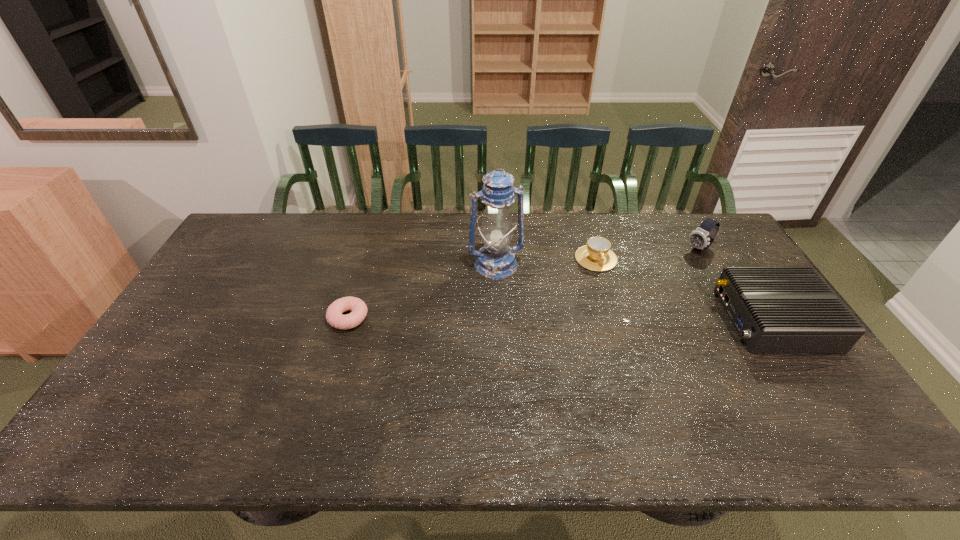
Image resolution: width=960 pixels, height=540 pixels. I want to click on blank space at the far left corner of the desktop, so click(x=255, y=251).

Find the location of a particular element. This screenshot has width=960, height=540. vacant region at the far right corner is located at coordinates (683, 224).

This screenshot has height=540, width=960. Find the location of `empty space that is in between the lantern and the shortest object`. empty space that is in between the lantern and the shortest object is located at coordinates (422, 292).

What are the coordinates of `free space that is in between the tallest object and the cup` in the screenshot? It's located at [x=546, y=262].

The width and height of the screenshot is (960, 540). I want to click on vacant region between the tallest object and the router, so click(635, 292).

The width and height of the screenshot is (960, 540). In order to click on free space between the fourth tallest object and the watch in this screenshot , I will do tap(648, 254).

Where is `blank region between the lantern and the second shortest object`? blank region between the lantern and the second shortest object is located at coordinates (546, 262).

Identify the location of free space between the doughnut and the watch. pos(524,284).

Image resolution: width=960 pixels, height=540 pixels. I want to click on free space that is in between the shortest object and the router, so click(x=561, y=319).

Where is `empty location between the lantern and the second shortest object`? empty location between the lantern and the second shortest object is located at coordinates (546, 262).